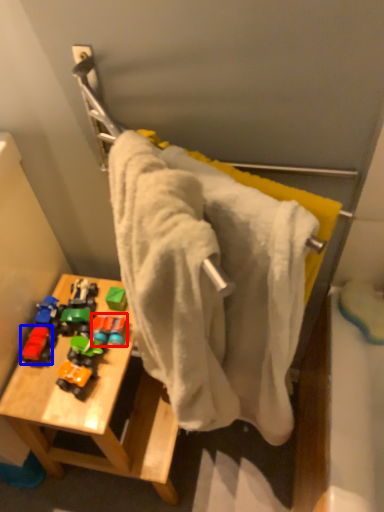
Question: Among these objects, which one is nearest to the camera, toy (highlighted by a red box) or toy (highlighted by a blue box)?

Choices:
 (A) toy
 (B) toy

Answer: (B)